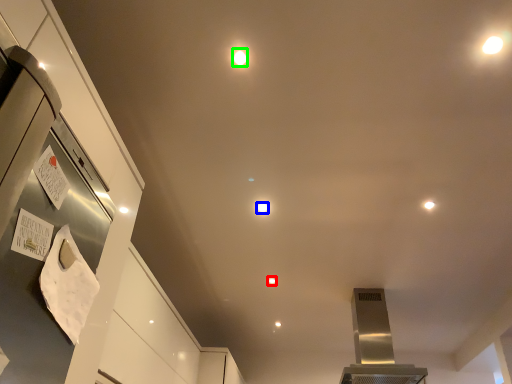
Question: Which is nearer to the light (highlighted by a red box)? light (highlighted by a blue box) or light (highlighted by a green box).

Choices:
 (A) light
 (B) light

Answer: (A)